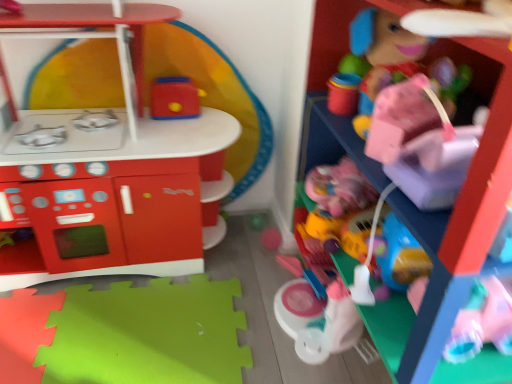
Question: Does matte plastic toy car at right, which is counted as the 3th toy, starting from the left, lie behind pink plastic toy at upper right, the 1th toy viewed from the right?

Choices:
 (A) yes
 (B) no

Answer: (A)

Question: Could you tell me if matte plastic toy car at right, which is counted as the 3th toy, starting from the left, is turned towards pink plastic toy at upper right, which ranks as the 4th toy in left-to-right order?

Choices:
 (A) yes
 (B) no

Answer: (A)

Question: Is matte plastic toy car at right, which is counted as the 3th toy, starting from the left, to the right of pink plastic toy at upper right, which ranks as the 4th toy in left-to-right order, from the viewer's perspective?

Choices:
 (A) no
 (B) yes

Answer: (A)

Question: Is matte plastic toy car at right, which is the second toy from right to left, looking in the opposite direction of pink plastic toy at upper right, which ranks as the 4th toy in left-to-right order?

Choices:
 (A) yes
 (B) no

Answer: (A)

Question: Considering the relative sizes of matte plastic toy car at right, which is counted as the 3th toy, starting from the left, and pink plastic toy at upper right, which ranks as the 4th toy in left-to-right order, in the image provided, is matte plastic toy car at right, which is counted as the 3th toy, starting from the left, bigger than pink plastic toy at upper right, which ranks as the 4th toy in left-to-right order,?

Choices:
 (A) yes
 (B) no

Answer: (B)

Question: From the image's perspective, is matte plastic toy car at right, which is the second toy from right to left, above or below matte plastic toaster at upper center, which is the second toy in left-to-right order?

Choices:
 (A) below
 (B) above

Answer: (A)

Question: In the image, is matte plastic toy car at right, which is counted as the 3th toy, starting from the left, positioned in front of or behind matte plastic toaster at upper center, which is the third toy in right-to-left order?

Choices:
 (A) behind
 (B) front

Answer: (B)

Question: Is matte plastic toy car at right, which is the second toy from right to left, inside the boundaries of matte plastic toaster at upper center, which is the third toy in right-to-left order, or outside?

Choices:
 (A) outside
 (B) inside

Answer: (A)

Question: From a real-world perspective, is matte plastic toy car at right, which is counted as the 3th toy, starting from the left, positioned above or below matte plastic toaster at upper center, which is the second toy in left-to-right order?

Choices:
 (A) below
 (B) above

Answer: (A)

Question: Relative to pink plastic toy at upper right, the 1th toy viewed from the right, is matte plastic play kitchen at left, which ranks as the 1th toy in left-to-right order, in front or behind?

Choices:
 (A) behind
 (B) front

Answer: (A)

Question: In terms of width, does matte plastic play kitchen at left, positioned as the fourth toy in right-to-left order, look wider or thinner when compared to pink plastic toy at upper right, which ranks as the 4th toy in left-to-right order?

Choices:
 (A) wide
 (B) thin

Answer: (B)

Question: Is matte plastic play kitchen at left, positioned as the fourth toy in right-to-left order, bigger or smaller than pink plastic toy at upper right, which ranks as the 4th toy in left-to-right order?

Choices:
 (A) big
 (B) small

Answer: (B)

Question: From the image's perspective, is matte plastic play kitchen at left, which ranks as the 1th toy in left-to-right order, positioned above or below pink plastic toy at upper right, which ranks as the 4th toy in left-to-right order?

Choices:
 (A) above
 (B) below

Answer: (A)

Question: From the image's perspective, is matte plastic toaster at upper center, which is the second toy in left-to-right order, above or below matte plastic play kitchen at left, which ranks as the 1th toy in left-to-right order?

Choices:
 (A) below
 (B) above

Answer: (B)

Question: From a real-world perspective, is matte plastic toaster at upper center, which is the second toy in left-to-right order, above or below matte plastic play kitchen at left, positioned as the fourth toy in right-to-left order?

Choices:
 (A) below
 (B) above

Answer: (B)